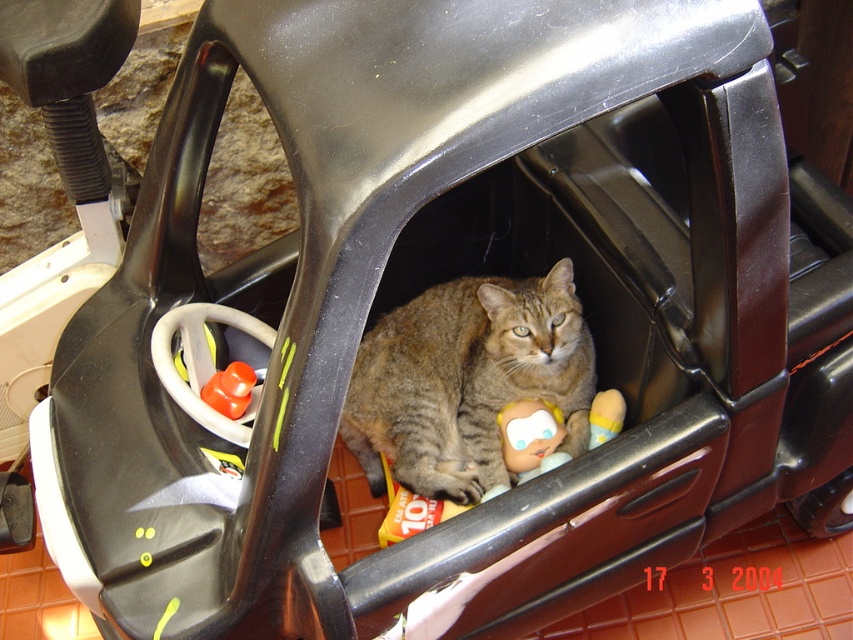
You are a child who wants to place a new toy between the gray striped fur cat at center and the smooth plastic doll at center in the toy car. The new toy is 6 inches long. Can you fit it between them without moving the existing toys?

The gray striped fur cat at center and the smooth plastic doll at center are 11.37 inches apart from each other. Since the new toy is 6 inches long, there is enough space between them to fit the toy without moving the existing toys.

You are a child who wants to place both the plastic baby doll at center and the smooth plastic doll at center on the dashboard of the toy car. However, the dashboard has limited space. Which doll should you place first to ensure both can fit?

The plastic baby doll at center is much taller than the smooth plastic doll at center, so you should place the smooth plastic doll at center first to accommodate the taller doll afterward.

From the picture: You are a child who wants to place both the plastic baby doll at center and the rubberized orange cup at center into a box that can only hold items within 60 centimeters in length. Can both items fit in the box together?

The plastic baby doll at center is 61.64 centimeters from rubberized orange cup at center, so the distance between them is greater than the box capacity. Therefore, they cannot both fit into the box together.